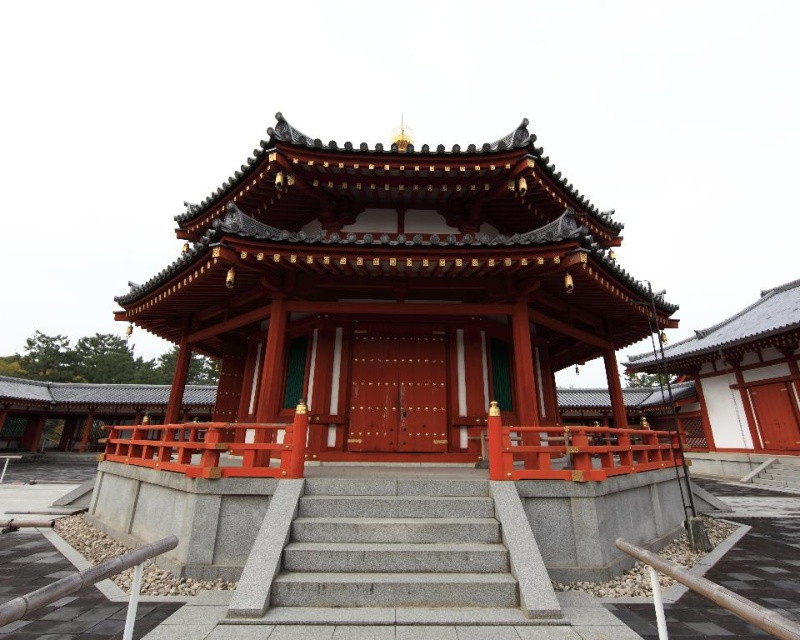
Question: Is gray granite stairs at center to the left of smooth glossy wood rail at center from the viewer's perspective?

Choices:
 (A) yes
 (B) no

Answer: (A)

Question: Does gray granite stairs at center come in front of smooth glossy wood rail at center?

Choices:
 (A) yes
 (B) no

Answer: (A)

Question: Is gray granite stairs at center positioned in front of brown wooden rail at lower left?

Choices:
 (A) yes
 (B) no

Answer: (B)

Question: Which point is closer to the camera?

Choices:
 (A) (242, 465)
 (B) (118, 566)

Answer: (B)

Question: Which is farther from the gray granite stairs at center?

Choices:
 (A) matte red wood temple at center
 (B) smooth wood railing at center

Answer: (A)

Question: Which object is the closest to the matte red wood temple at center?

Choices:
 (A) gray granite stairs at center
 (B) brown wooden rail at lower left

Answer: (A)